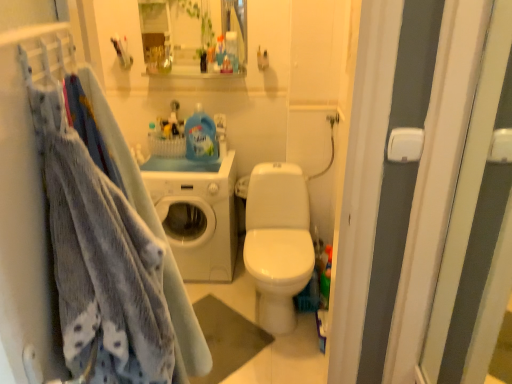
Describe the element at coordinates (192, 36) in the screenshot. Image resolution: width=512 pixels, height=384 pixels. I see `matte white cabinet at upper center` at that location.

In order to face soft blue fabric at left, should I rotate leftwards or rightwards?

Rotate your view left by about 19.776°.

What do you see at coordinates (198, 213) in the screenshot?
I see `white glossy washing machine at center` at bounding box center [198, 213].

What are the coordinates of `matte white cabinet at upper center` in the screenshot? It's located at (192, 36).

Which is behind, matte white cabinet at upper center or white glossy washing machine at center?

matte white cabinet at upper center.

The width and height of the screenshot is (512, 384). What are the coordinates of `cabinet located above the white glossy washing machine at center (from a real-world perspective)` in the screenshot? It's located at (192, 36).

Does matte white cabinet at upper center have a larger size compared to white glossy washing machine at center?

Actually, matte white cabinet at upper center might be smaller than white glossy washing machine at center.

In the scene shown: Which point is more distant from viewer, [183,32] or [35,235]?

Positioned behind is point [183,32].

Can you tell me how much matte white cabinet at upper center and soft blue fabric at left differ in facing direction?

104 degrees separate the facing orientations of matte white cabinet at upper center and soft blue fabric at left.

Considering the sizes of objects matte white cabinet at upper center and soft blue fabric at left in the image provided, who is thinner, matte white cabinet at upper center or soft blue fabric at left?

soft blue fabric at left.

From a real-world perspective, is matte white cabinet at upper center above or below soft blue fabric at left?

Clearly, from a real-world perspective, matte white cabinet at upper center is above soft blue fabric at left.

From the image's perspective, would you say soft blue fabric at left is positioned over matte white cabinet at upper center?

No, from the image's perspective, soft blue fabric at left is not over matte white cabinet at upper center.

Is point (24, 213) farther from viewer compared to point (208, 4)?

No, (24, 213) is closer to viewer.

Considering the relative sizes of soft blue fabric at left and matte white cabinet at upper center in the image provided, is soft blue fabric at left bigger than matte white cabinet at upper center?

Correct, soft blue fabric at left is larger in size than matte white cabinet at upper center.

Do you think white glossy washing machine at center is within soft blue fabric at left, or outside of it?

white glossy washing machine at center exists outside the volume of soft blue fabric at left.

Can you confirm if white glossy washing machine at center is smaller than soft blue fabric at left?

No, white glossy washing machine at center is not smaller than soft blue fabric at left.

Would you say white glossy washing machine at center is to the left or to the right of soft blue fabric at left in the picture?

Clearly, white glossy washing machine at center is on the left of soft blue fabric at left in the image.

In order to click on cabinet to the right of white glossy washing machine at center in this screenshot , I will do point(192,36).

Is white glossy washing machine at center positioned behind matte white cabinet at upper center?

No, the depth of white glossy washing machine at center is less than that of matte white cabinet at upper center.

From the image's perspective, which one is positioned lower, white glossy washing machine at center or matte white cabinet at upper center?

From the image's view, white glossy washing machine at center is below.

Does point (233, 219) appear closer or farther from the camera than point (180, 67)?

Clearly, point (233, 219) is closer to the camera than point (180, 67).

Can you see soft blue fabric at left touching white glossy washing machine at center?

soft blue fabric at left is not next to white glossy washing machine at center, and they're not touching.

Is soft blue fabric at left thinner than white glossy washing machine at center?

Yes.

Is soft blue fabric at left facing towards white glossy washing machine at center?

No, soft blue fabric at left is not turned towards white glossy washing machine at center.

From a real-world perspective, is soft blue fabric at left above or below white glossy washing machine at center?

From a real-world perspective, soft blue fabric at left is physically above white glossy washing machine at center.

This screenshot has width=512, height=384. Find the location of `washing machine located on the left of matte white cabinet at upper center`. washing machine located on the left of matte white cabinet at upper center is located at coordinates (198, 213).

Image resolution: width=512 pixels, height=384 pixels. Find the location of `cabinet above the soft blue fabric at left (from a real-world perspective)`. cabinet above the soft blue fabric at left (from a real-world perspective) is located at coordinates (192, 36).

When comparing their distances from white glossy washing machine at center, does soft blue fabric at left or matte white cabinet at upper center seem further?

Based on the image, matte white cabinet at upper center appears to be further to white glossy washing machine at center.

From the image, which object appears to be nearer to matte white cabinet at upper center, white glossy washing machine at center or soft blue fabric at left?

white glossy washing machine at center is positioned closer to the anchor matte white cabinet at upper center.

Looking at the image, which one is located further to soft blue fabric at left, matte white cabinet at upper center or white glossy washing machine at center?

Among the two, matte white cabinet at upper center is located further to soft blue fabric at left.

Based on their spatial positions, is white glossy washing machine at center or matte white cabinet at upper center closer to soft blue fabric at left?

white glossy washing machine at center lies closer to soft blue fabric at left than the other object.

From the image, which object appears to be farther from white glossy washing machine at center, matte white cabinet at upper center or soft blue fabric at left?

Among the two, matte white cabinet at upper center is located further to white glossy washing machine at center.

Which object lies further to the anchor point matte white cabinet at upper center, soft blue fabric at left or white glossy washing machine at center?

soft blue fabric at left is positioned further to the anchor matte white cabinet at upper center.

You are a GUI agent. You are given a task and a screenshot of the screen. Output one action in this format:
    pyautogui.click(x=<x>, y=<y>)
    Task: Click on the washing machine positioned between soft blue fabric at left and matte white cabinet at upper center from near to far
    The width and height of the screenshot is (512, 384).
    Given the screenshot: What is the action you would take?
    pyautogui.click(x=198, y=213)